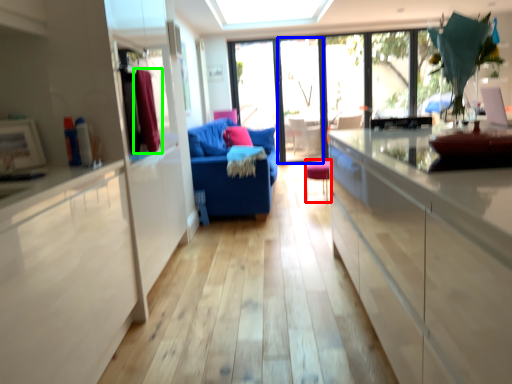
Question: Based on their relative distances, which object is farther from chair (highlighted by a red box)? Choose from screen door (highlighted by a blue box) and curtain (highlighted by a green box).

Choices:
 (A) screen door
 (B) curtain

Answer: (B)